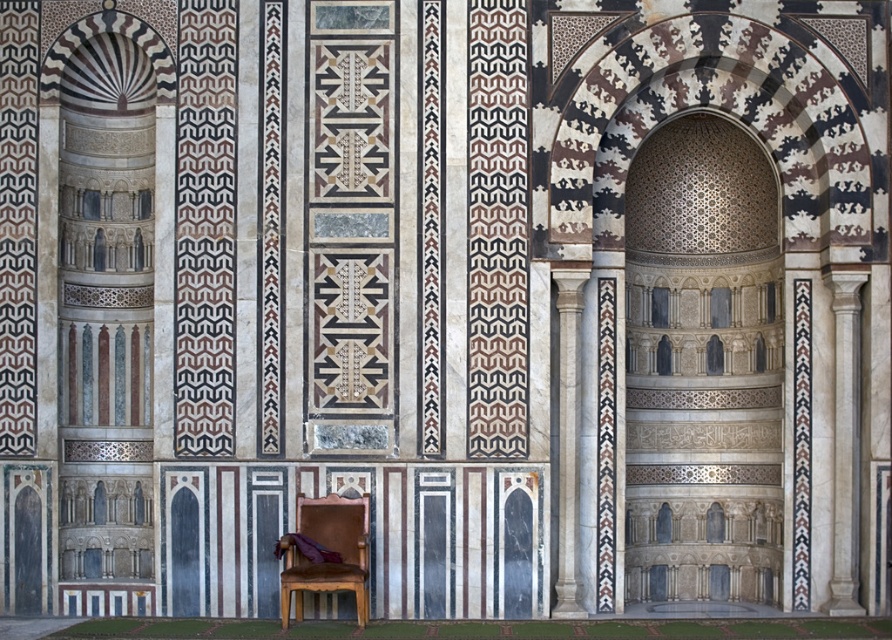
Between brown leather armchair at lower center and white marble column at center, which one is positioned higher?

white marble column at center is above.

Between brown leather armchair at lower center and white marble column at center, which one appears on the right side from the viewer's perspective?

white marble column at center

You are a GUI agent. You are given a task and a screenshot of the screen. Output one action in this format:
    pyautogui.click(x=<x>, y=<y>)
    Task: Click on the brown leather armchair at lower center
    The width and height of the screenshot is (892, 640).
    Given the screenshot: What is the action you would take?
    coord(327,548)